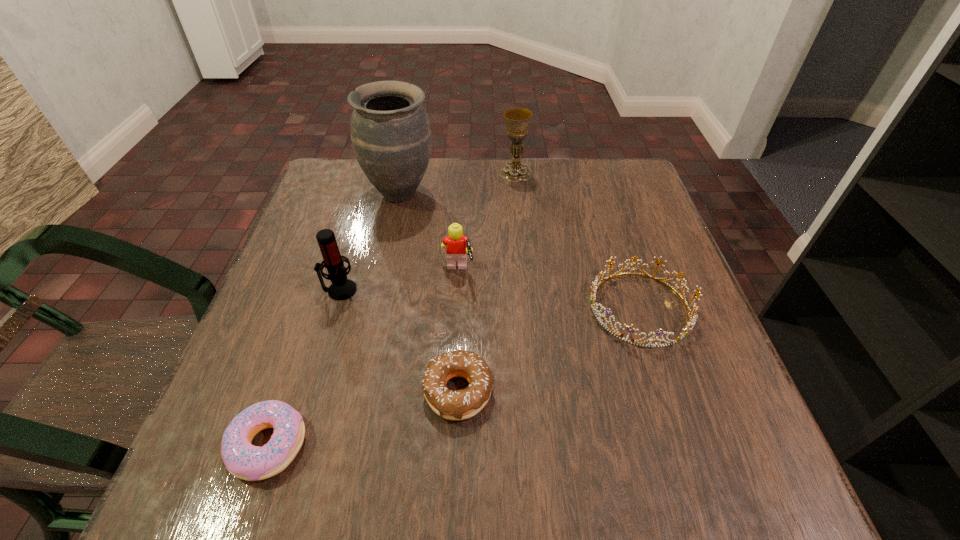
You are a GUI agent. You are given a task and a screenshot of the screen. Output one action in this format:
    pyautogui.click(x=<x>, y=<y>)
    Task: Click on the free spot between the right doughnut and the tallest object
    This screenshot has height=540, width=960.
    Given the screenshot: What is the action you would take?
    pyautogui.click(x=429, y=292)

You are a GUI agent. You are given a task and a screenshot of the screen. Output one action in this format:
    pyautogui.click(x=<x>, y=<y>)
    Task: Click on the object that ranks as the third closest to the rightmost object
    
    Given the screenshot: What is the action you would take?
    pyautogui.click(x=517, y=120)

Locate an element on the screen. The width and height of the screenshot is (960, 540). the closest object to the chalice is located at coordinates (390, 131).

Identify the location of vacant area that satisfies the following two spatial constraints: 1. on the back side of the chalice; 2. on the right side of the microphone. The image size is (960, 540). (374, 173).

At what (x,y) coordinates should I click in order to perform the action: click on blank space that satisfies the following two spatial constraints: 1. in front of the right doughnut with the accessory visible; 2. on the right side of the Lego. Please return your answer as a coordinate pair (x, y). The image size is (960, 540). Looking at the image, I should click on (452, 392).